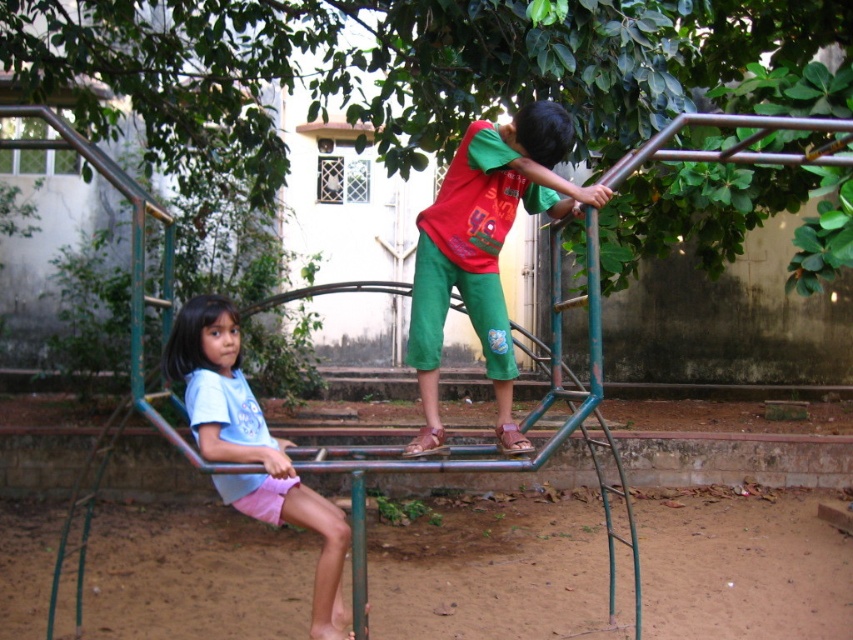
Question: Which of the following is the closest to the observer?

Choices:
 (A) (312, 621)
 (B) (437, 266)

Answer: (A)

Question: Does green cotton pants at center appear under light blue fabric shirt at left?

Choices:
 (A) no
 (B) yes

Answer: (A)

Question: Does green cotton pants at center come behind light blue fabric shirt at left?

Choices:
 (A) yes
 (B) no

Answer: (A)

Question: Observing the image, what is the correct spatial positioning of green cotton pants at center in reference to light blue fabric shirt at left?

Choices:
 (A) above
 (B) below

Answer: (A)